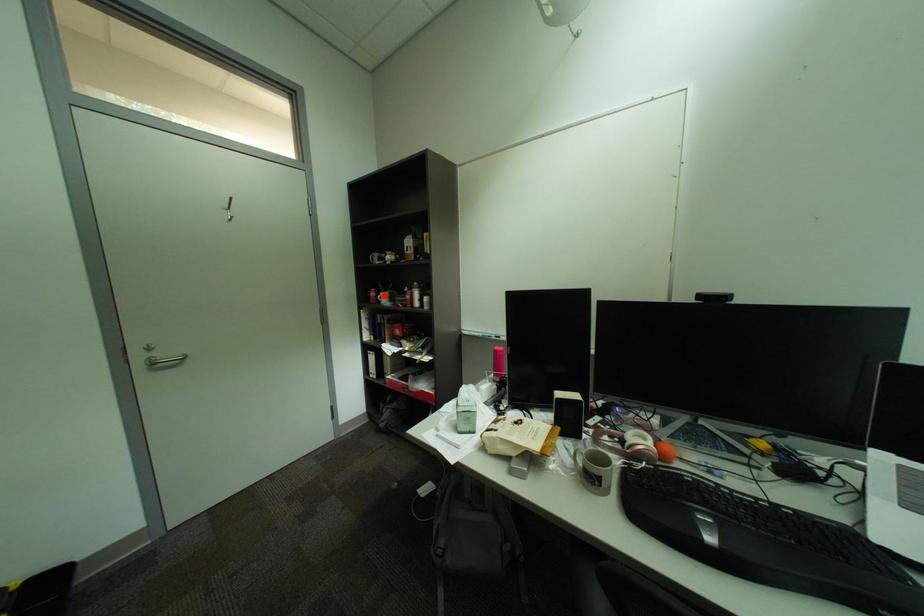
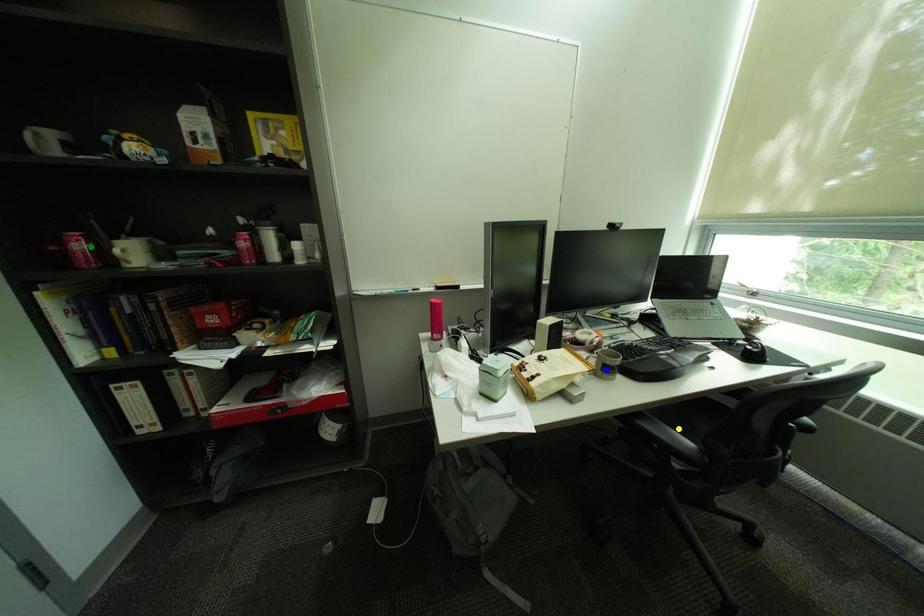
Question: I am providing you with two images of the same scene from different viewpoints. A red point is marked on the first image. You are given multiple points on the second image. Which point in image 2 is actually the same real-world point as the red point in image 1?

Choices:
 (A) green point
 (B) blue point
 (C) yellow point

Answer: (A)